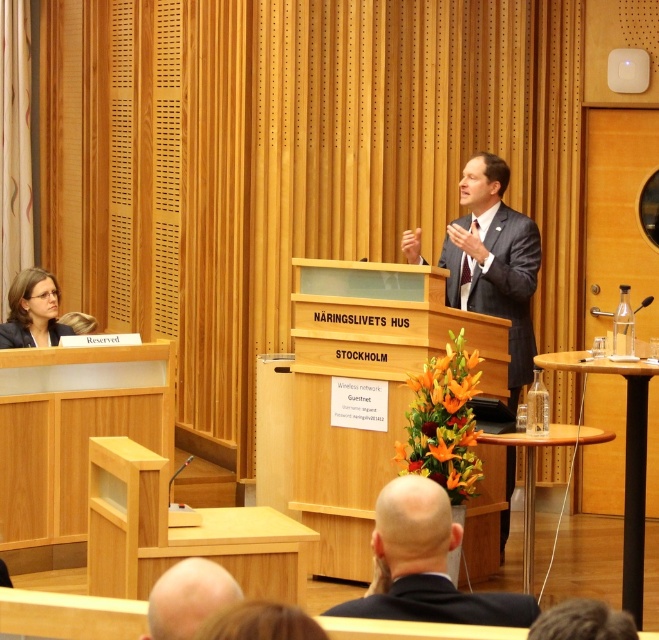
Question: Can you confirm if dark gray suit at center is positioned above matte black blazer at left?

Choices:
 (A) yes
 (B) no

Answer: (A)

Question: Among these objects, which one is farthest from the camera?

Choices:
 (A) dark gray suit at center
 (B) black matte suit at lower center
 (C) bald head at lower center
 (D) matte black blazer at left

Answer: (D)

Question: Is black suit at center wider than black matte suit at lower center?

Choices:
 (A) no
 (B) yes

Answer: (A)

Question: Which object is closer to the camera taking this photo?

Choices:
 (A) black suit at center
 (B) matte black suit at lower left

Answer: (A)

Question: Is bald head at lower center to the left of matte black blazer at left from the viewer's perspective?

Choices:
 (A) no
 (B) yes

Answer: (A)

Question: Which point is closer to the camera taking this photo?

Choices:
 (A) (192, 577)
 (B) (18, 344)
 (C) (416, 497)
 (D) (501, 252)

Answer: (A)